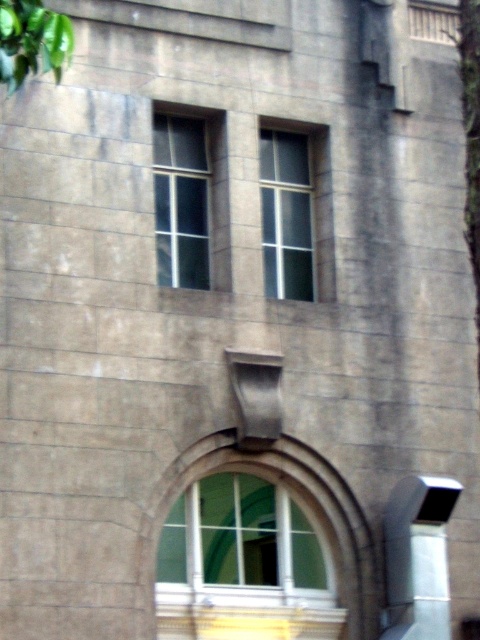
Question: Can you confirm if clear glass window at upper center is positioned below clear glass window at center?

Choices:
 (A) no
 (B) yes

Answer: (A)

Question: Which point appears closest to the camera in this image?

Choices:
 (A) (165, 259)
 (B) (283, 531)

Answer: (A)

Question: From the image, what is the correct spatial relationship of clear glass window at upper center in relation to clear glass window at center?

Choices:
 (A) above
 (B) below

Answer: (A)

Question: Which object appears farthest from the camera in this image?

Choices:
 (A) green glass window at center
 (B) green leafy tree at upper left

Answer: (A)

Question: From the image, what is the correct spatial relationship of clear glass window at upper center in relation to green leafy tree at upper left?

Choices:
 (A) right
 (B) left

Answer: (A)

Question: Estimate the real-world distances between objects in this image. Which object is closer to the green leafy tree at upper left?

Choices:
 (A) clear glass window at upper center
 (B) clear glass window at center
 (C) green glass window at center

Answer: (A)